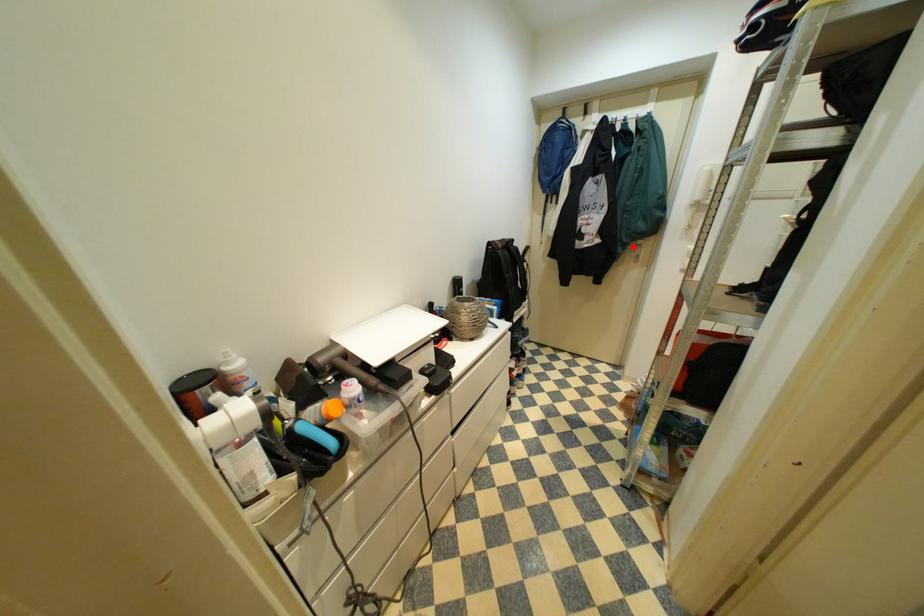
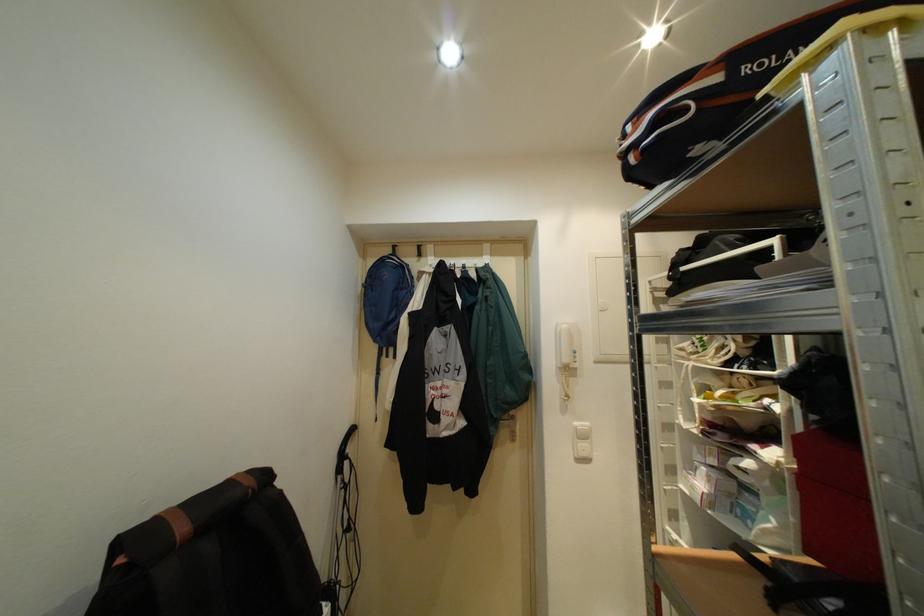
Question: A red point is marked in image1. In image2, is the corresponding 3D point closer to the camera or farther? Reply with the corresponding letter.

Choices:
 (A) The corresponding 3D point is closer.
 (B) The corresponding 3D point is farther.

Answer: (B)